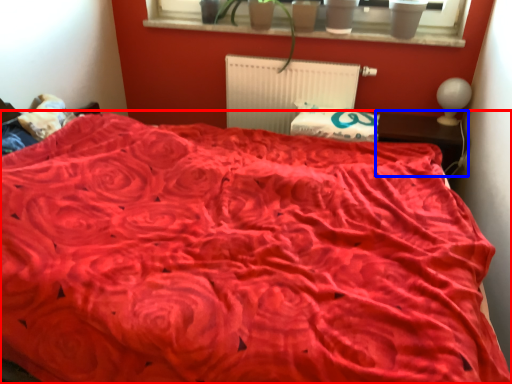
Question: Which object appears closest to the camera in this image, bed (highlighted by a red box) or table (highlighted by a blue box)?

Choices:
 (A) bed
 (B) table

Answer: (A)